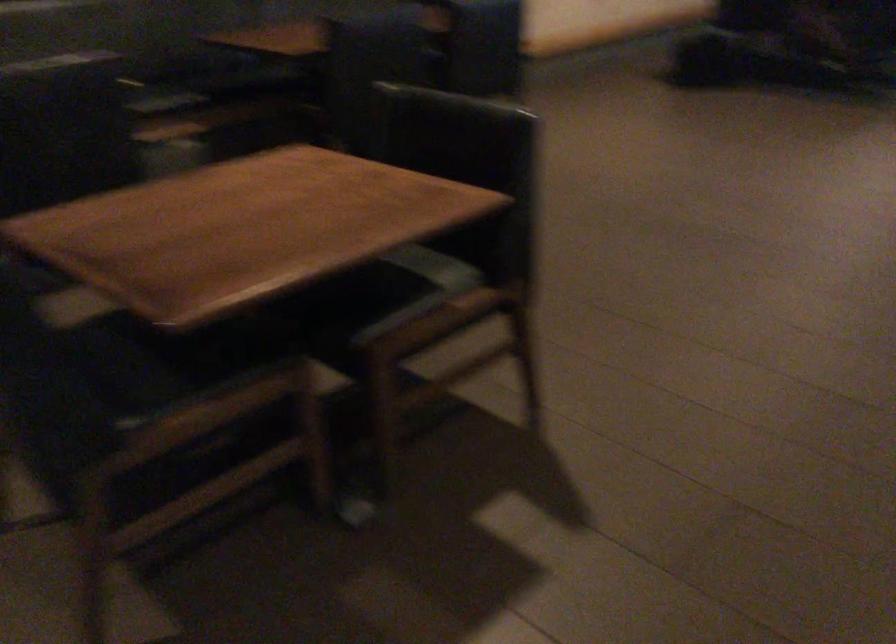
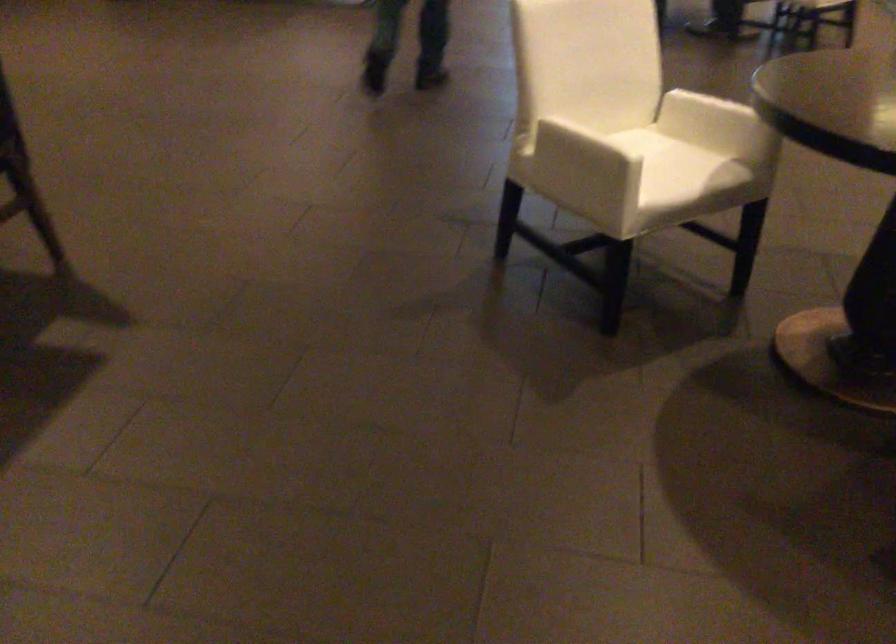
Question: The images are taken continuously from a first-person perspective. In which direction is your viewpoint rotating?

Choices:
 (A) Left
 (B) Right
 (C) Up
 (D) Down

Answer: (B)